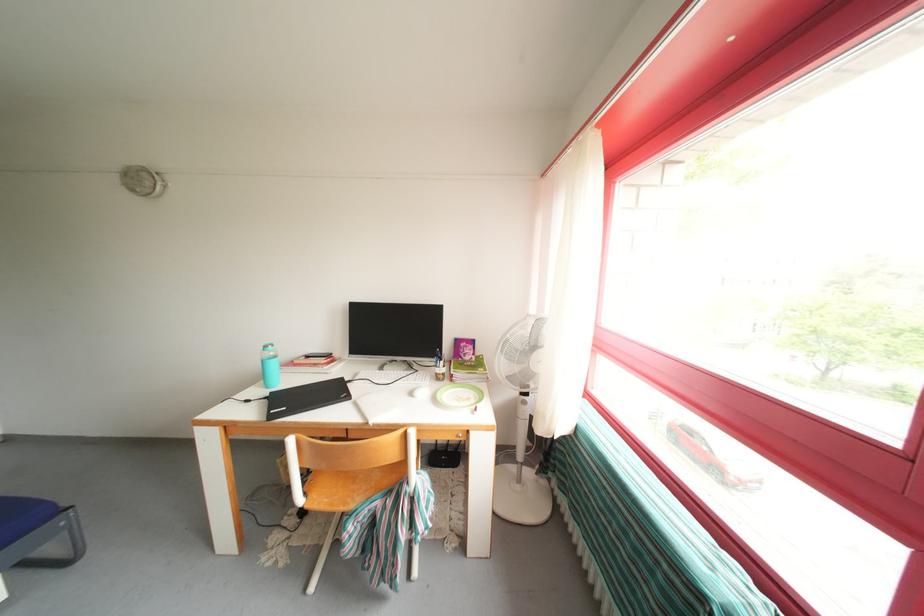
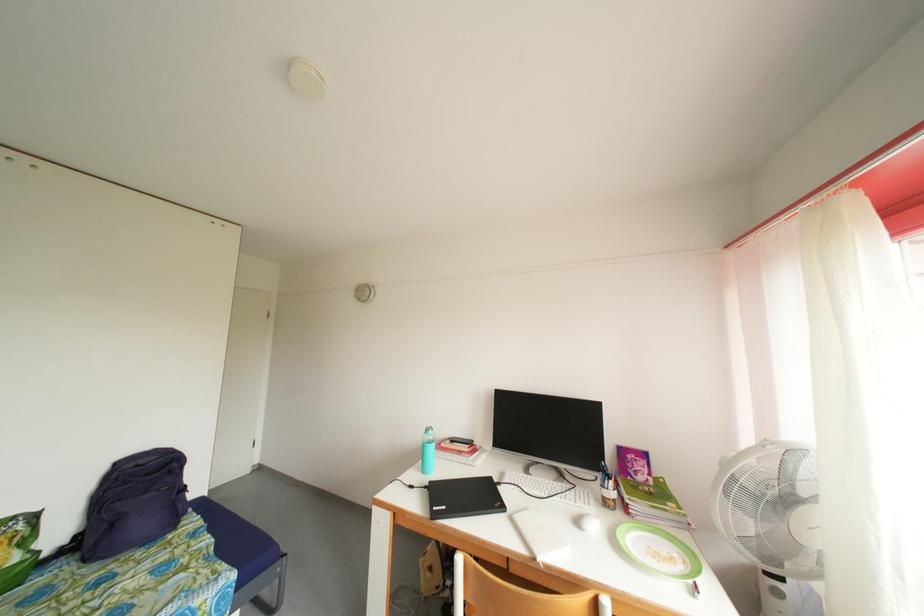
Locate, in the second image, the point that corresponds to [480,407] in the first image.

(688, 573)